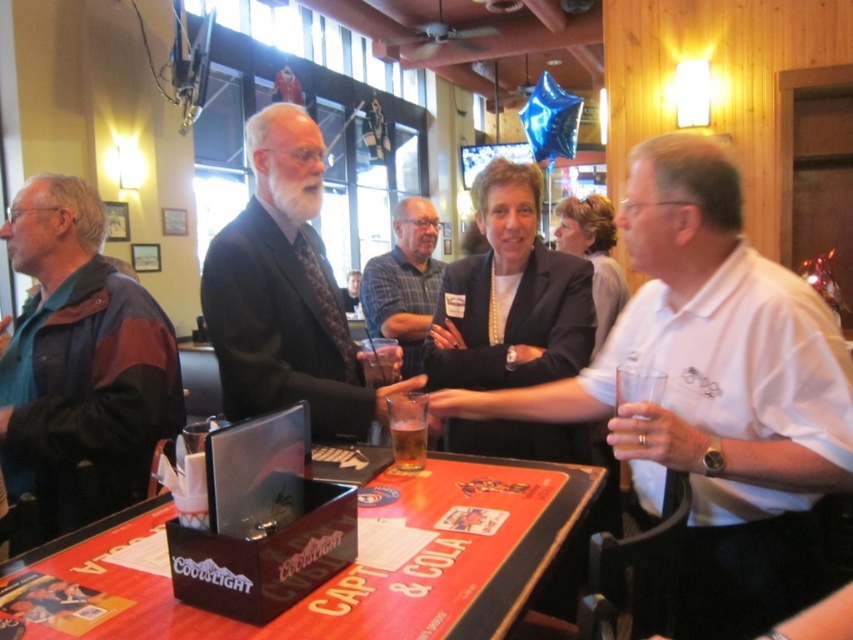
Question: Which object appears closest to the camera in this image?

Choices:
 (A) plaid shirt at center
 (B) teal leather jacket at left
 (C) dark suit at center

Answer: (B)

Question: Which object is closer to the camera taking this photo?

Choices:
 (A) orange laminate table at center
 (B) plaid shirt at center
 (C) clear glass at center
 (D) white cotton shirt at center

Answer: (A)

Question: From the image, what is the correct spatial relationship of plaid shirt at center in relation to clear glass at center?

Choices:
 (A) left
 (B) right

Answer: (B)

Question: Considering the relative positions of white cotton shirt at center and dark suit at center in the image provided, where is white cotton shirt at center located with respect to dark suit at center?

Choices:
 (A) above
 (B) below

Answer: (B)

Question: Does orange laminate table at center appear under translucent glass beer at table center?

Choices:
 (A) yes
 (B) no

Answer: (A)

Question: Which of the following is the closest to the observer?

Choices:
 (A) (426, 426)
 (B) (421, 244)

Answer: (A)